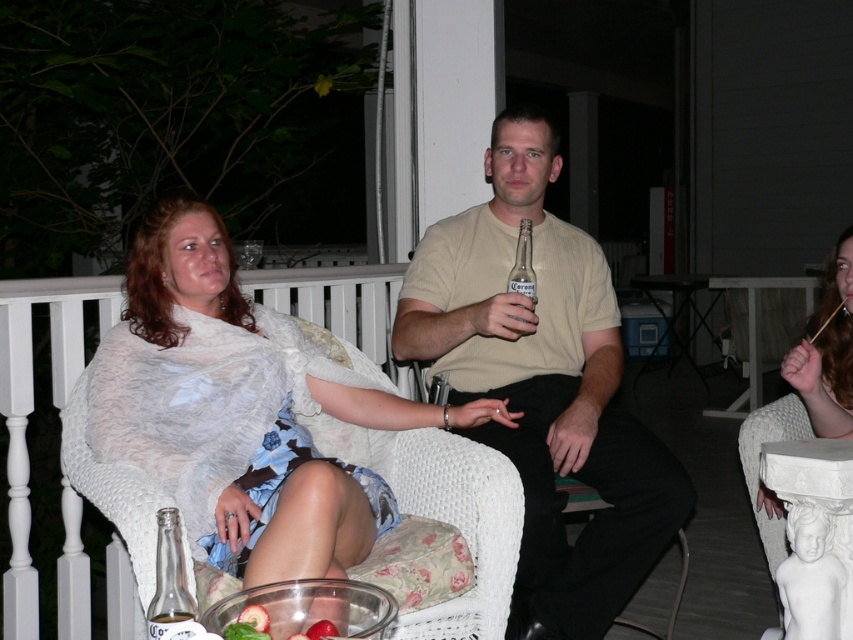
From the picture: You are a waiter at this outdoor gathering. You need to deliver a drink to the person wearing the beige cotton shirt at center. The drink is currently in the translucent glass bottle at lower left. Can you reach the person without moving more than 1.5 meters from the bottle?

The beige cotton shirt at center is 1.45 meters from the translucent glass bottle at lower left, so yes, you can reach them without moving more than 1.5 meters from the bottle.

You are standing on the porch and want to place a decorative plant between the two points marked as point (200,508) and point (157,525). Which point should the plant be closer to in order to be positioned between them?

The plant should be closer to point (157,525) because point (200,508) is behind it, so placing the plant near the front point would keep it between them.

You are a guest at this outdoor gathering and want to grab the clear glass beer bottle at center without disturbing the beige cotton shirt at center. How should you reach for it?

The beige cotton shirt at center is below the clear glass beer bottle at center, so you can safely reach upward to grab the clear glass beer bottle at center without disturbing the beige cotton shirt at center.